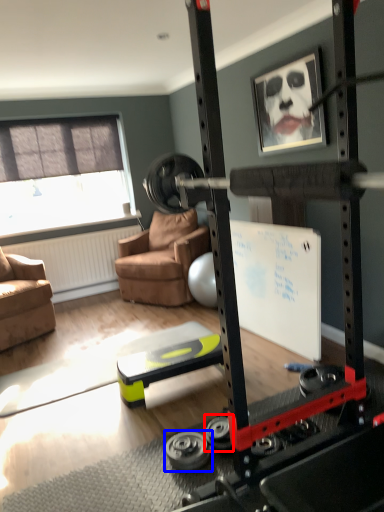
Question: Which object appears closest to the camera in this image, wheel (highlighted by a red box) or wheel (highlighted by a blue box)?

Choices:
 (A) wheel
 (B) wheel

Answer: (B)